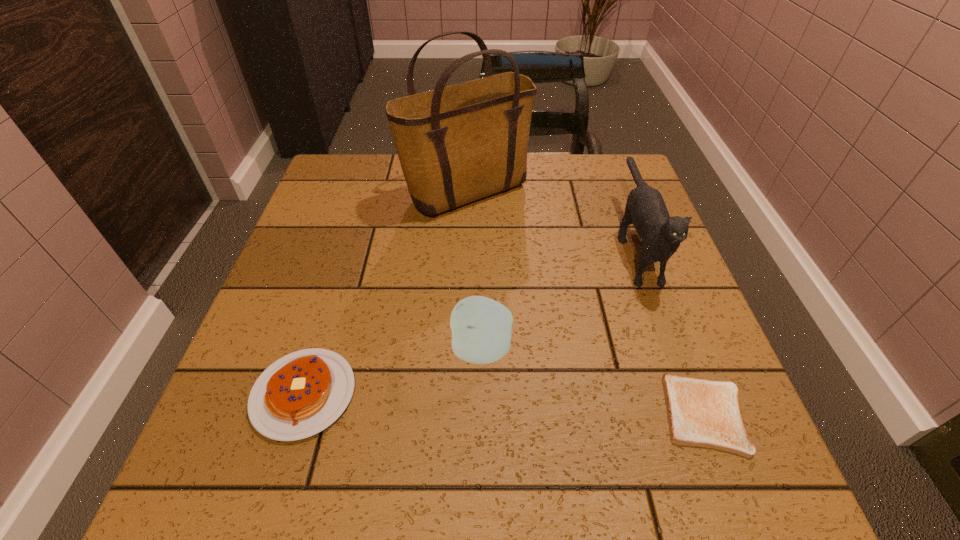
Locate an element on the screen. vacant area located 0.350m on the back of the toast is located at coordinates (639, 244).

Where is `tote bag present at the far edge`? The width and height of the screenshot is (960, 540). tote bag present at the far edge is located at coordinates (456, 144).

I want to click on cat that is at the far edge, so [661, 235].

Where is `object positioned at the near edge`? This screenshot has height=540, width=960. object positioned at the near edge is located at coordinates (705, 413).

This screenshot has height=540, width=960. I want to click on object positioned at the left edge, so click(x=299, y=395).

You are a GUI agent. You are given a task and a screenshot of the screen. Output one action in this format:
    pyautogui.click(x=<x>, y=<y>)
    Task: Click on the cat situated at the right edge
    The image size is (960, 540).
    Given the screenshot: What is the action you would take?
    pyautogui.click(x=661, y=235)

Identify the location of toast that is at the right edge. [x=705, y=413].

At what (x,y) coordinates should I click in order to perform the action: click on object present at the far right corner. Please return your answer as a coordinate pair (x, y). Looking at the image, I should click on (661, 235).

Image resolution: width=960 pixels, height=540 pixels. In order to click on object situated at the near right corner in this screenshot , I will do `click(705, 413)`.

Find the location of a particular element. free space at the far edge of the desktop is located at coordinates (552, 188).